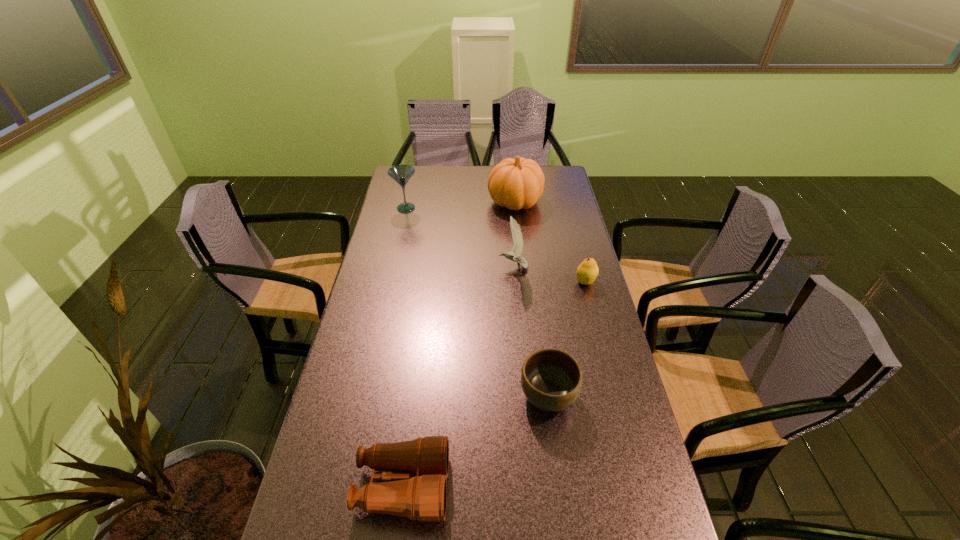
Where is `the tallest object`? the tallest object is located at coordinates (518, 183).

At what (x,y) coordinates should I click in order to perform the action: click on martini. Please return your answer as a coordinate pair (x, y). Looking at the image, I should click on 401,174.

Identify the location of the third tallest object. The height and width of the screenshot is (540, 960). (517, 249).

Where is `the second nearest object`? The width and height of the screenshot is (960, 540). the second nearest object is located at coordinates (551, 379).

I want to click on the rightmost object, so click(587, 271).

Where is `the nearest object`? The width and height of the screenshot is (960, 540). the nearest object is located at coordinates (422, 496).

Where is `blank area located 0.390m on the front of the tallest object`? The height and width of the screenshot is (540, 960). blank area located 0.390m on the front of the tallest object is located at coordinates (523, 281).

At what (x,y) coordinates should I click in order to perform the action: click on vacant space located on the front of the fifth shortest object. Please return your answer as a coordinate pair (x, y). Looking at the image, I should click on (390, 280).

In order to click on vacant area situated at the tip of the beak of the third tallest object in this screenshot , I will do `click(389, 267)`.

Where is `free spot located at the tip of the beak of the third tallest object`? The height and width of the screenshot is (540, 960). free spot located at the tip of the beak of the third tallest object is located at coordinates (466, 267).